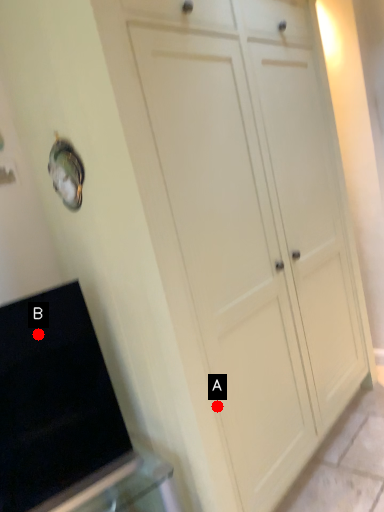
Question: Two points are circled on the image, labeled by A and B beside each circle. Which of the following is the closest to the observer?

Choices:
 (A) A is closer
 (B) B is closer

Answer: (B)